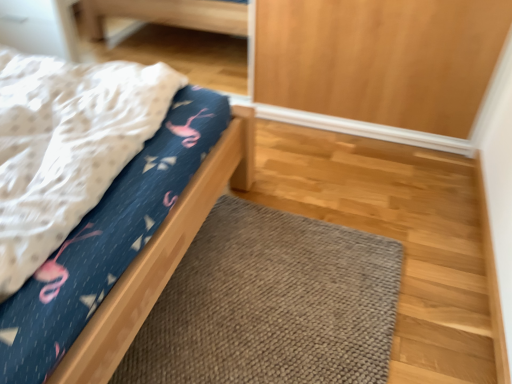
Question: Can we say matte blue fabric bed at left lies outside brown knitted doormat at lower center?

Choices:
 (A) no
 (B) yes

Answer: (B)

Question: Is matte blue fabric bed at left to the right of brown knitted doormat at lower center from the viewer's perspective?

Choices:
 (A) no
 (B) yes

Answer: (A)

Question: Does matte blue fabric bed at left have a smaller size compared to brown knitted doormat at lower center?

Choices:
 (A) no
 (B) yes

Answer: (A)

Question: Does matte blue fabric bed at left have a lesser width compared to brown knitted doormat at lower center?

Choices:
 (A) yes
 (B) no

Answer: (B)

Question: Is matte blue fabric bed at left turned away from brown knitted doormat at lower center?

Choices:
 (A) no
 (B) yes

Answer: (A)

Question: From the image's perspective, is matte blue fabric bed at left on top of brown knitted doormat at lower center?

Choices:
 (A) no
 (B) yes

Answer: (B)

Question: Is brown knitted doormat at lower center located outside matte blue fabric bed at left?

Choices:
 (A) yes
 (B) no

Answer: (A)

Question: Is brown knitted doormat at lower center thinner than matte blue fabric bed at left?

Choices:
 (A) no
 (B) yes

Answer: (B)

Question: Can you confirm if brown knitted doormat at lower center is shorter than matte blue fabric bed at left?

Choices:
 (A) yes
 (B) no

Answer: (A)

Question: Does brown knitted doormat at lower center have a greater width compared to matte blue fabric bed at left?

Choices:
 (A) no
 (B) yes

Answer: (A)

Question: From the image's perspective, does brown knitted doormat at lower center appear higher than matte blue fabric bed at left?

Choices:
 (A) yes
 (B) no

Answer: (B)

Question: Is brown knitted doormat at lower center not close to matte blue fabric bed at left?

Choices:
 (A) yes
 (B) no

Answer: (B)

Question: Is matte blue fabric bed at left taller or shorter than brown knitted doormat at lower center?

Choices:
 (A) short
 (B) tall

Answer: (B)